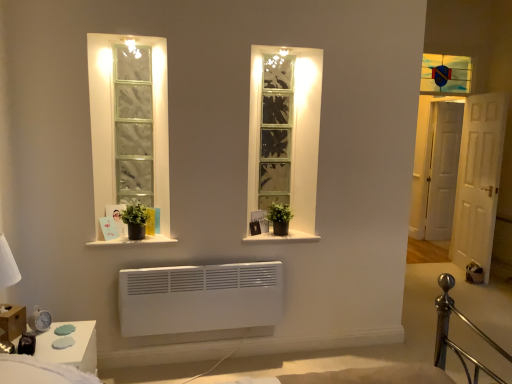
Question: Is white wooden door at right, arranged as the 1th door when viewed from the left, directly adjacent to clear glass window at center?

Choices:
 (A) yes
 (B) no

Answer: (B)

Question: Is white wooden door at right, the second door from the right, thinner than clear glass window at center?

Choices:
 (A) no
 (B) yes

Answer: (A)

Question: Does white wooden door at right, which appears as the first door when viewed from the front, have a smaller size compared to clear glass window at center?

Choices:
 (A) no
 (B) yes

Answer: (A)

Question: Considering the relative sizes of white wooden door at right, which appears as the first door when viewed from the front, and clear glass window at center in the image provided, is white wooden door at right, which appears as the first door when viewed from the front, taller than clear glass window at center?

Choices:
 (A) no
 (B) yes

Answer: (B)

Question: Does white wooden door at right, the second door from the right, have a larger size compared to clear glass window at center?

Choices:
 (A) no
 (B) yes

Answer: (B)

Question: Does white wooden door at right, which appears as the first door when viewed from the front, appear on the left side of clear glass window at center?

Choices:
 (A) no
 (B) yes

Answer: (A)

Question: Can you confirm if white wooden door at right, which appears as the first door when viewed from the front, is shorter than stained glass window at upper right?

Choices:
 (A) no
 (B) yes

Answer: (A)

Question: Can you confirm if white wooden door at right, the second door from the right, is bigger than stained glass window at upper right?

Choices:
 (A) no
 (B) yes

Answer: (B)

Question: Is white wooden door at right, arranged as the 1th door when viewed from the left, closer to the viewer compared to stained glass window at upper right?

Choices:
 (A) no
 (B) yes

Answer: (B)

Question: Is white wooden door at right, the second door from the right, next to stained glass window at upper right?

Choices:
 (A) yes
 (B) no

Answer: (B)

Question: From a real-world perspective, is white wooden door at right, arranged as the 1th door when viewed from the left, physically above stained glass window at upper right?

Choices:
 (A) yes
 (B) no

Answer: (B)

Question: Would you consider white glossy window sill at center, which appears as the 1th window sill when viewed from the right, to be distant from green matte plant at center?

Choices:
 (A) no
 (B) yes

Answer: (A)